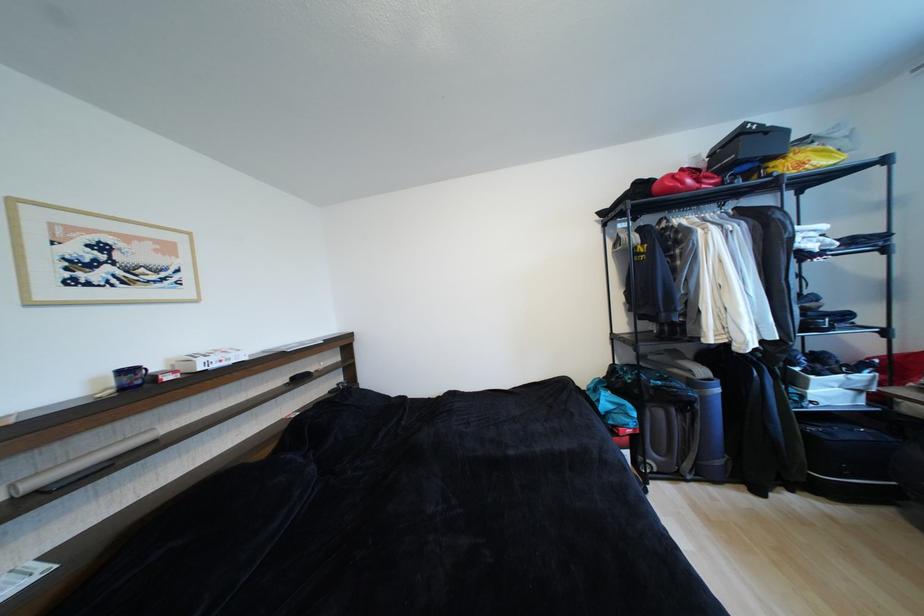
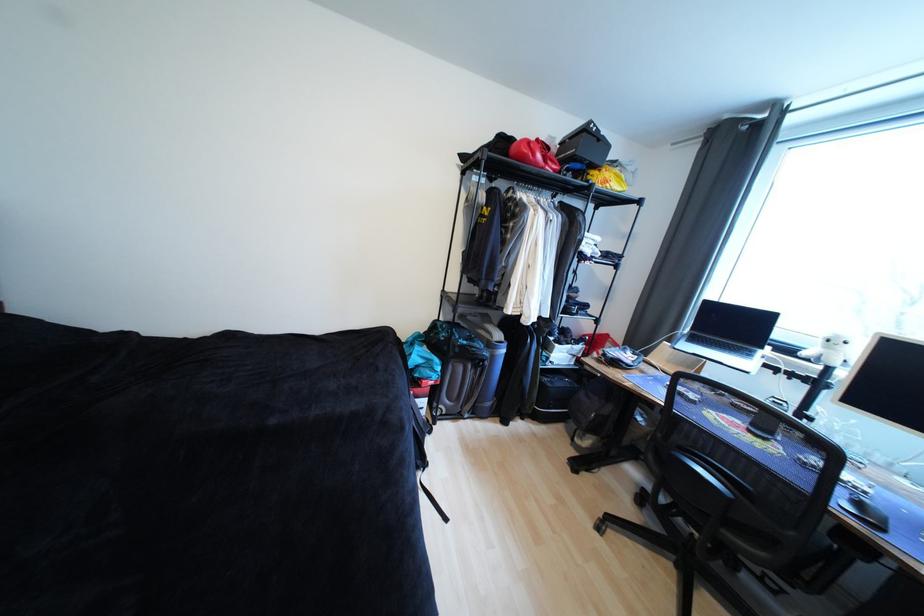
Where in the second image is the point corresponding to (676,192) from the first image?

(529, 159)